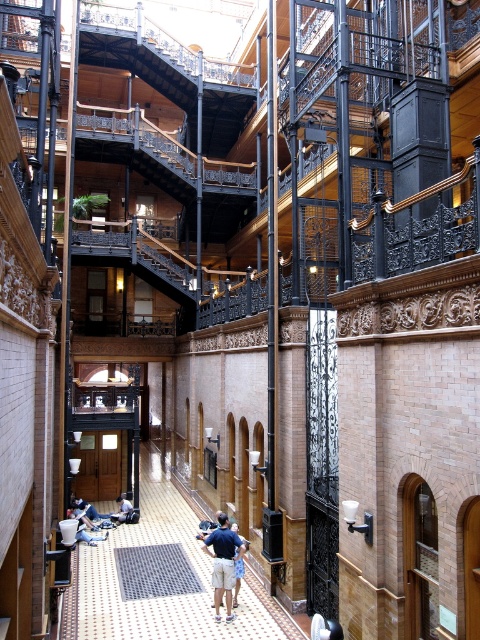
You are an architect designing a new exhibition space in this building. You need to decide where to place a large sculpture that requires a minimum of 5 meters of space. Given the polished wood corridor at center and the metallic grid floor at center, which area would be suitable for placing the sculpture?

The polished wood corridor at center is bigger than the metallic grid floor at center, so the sculpture should be placed in the polished wood corridor at center to meet the space requirement.

You are standing in the atrium of the grand building and notice a point marked at coordinates (x=154, y=572). Based on the scene description, where exactly is this point located?

The point is located on the metallic grid floor at the center of the atrium.